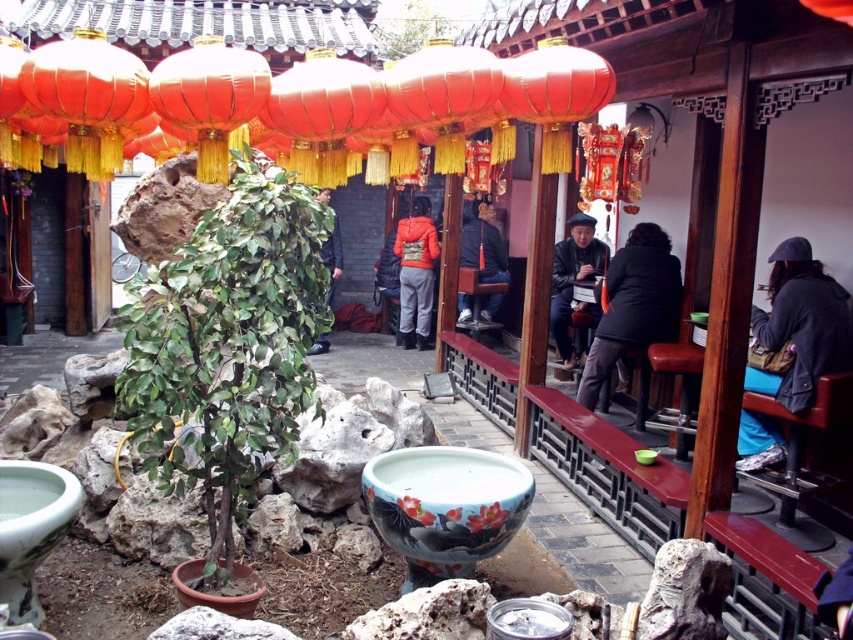
Which is above, blue fabric jacket at right or shiny red lantern at upper left?

shiny red lantern at upper left is higher up.

Where is `blue fabric jacket at right`? This screenshot has height=640, width=853. blue fabric jacket at right is located at coordinates (799, 326).

Find the location of a particular element. blue fabric jacket at right is located at coordinates (799, 326).

Can you confirm if shiny red lantern at upper left is positioned above dark gray jacket at center?

Incorrect, shiny red lantern at upper left is not positioned above dark gray jacket at center.

At what (x,y) coordinates should I click in order to perform the action: click on shiny red lantern at upper left. Please return your answer as a coordinate pair (x, y). Image resolution: width=853 pixels, height=640 pixels. Looking at the image, I should click on (88, 97).

Is green leafy tree at upper center above camouflage fabric jacket at center?

Indeed, green leafy tree at upper center is positioned over camouflage fabric jacket at center.

Is point (440, 19) positioned in front of point (318, 353)?

No, (440, 19) is behind (318, 353).

Between point (410, 17) and point (320, 342), which one is positioned behind?

Positioned behind is point (410, 17).

Find the location of a particular element. The width and height of the screenshot is (853, 640). green leafy tree at upper center is located at coordinates (410, 28).